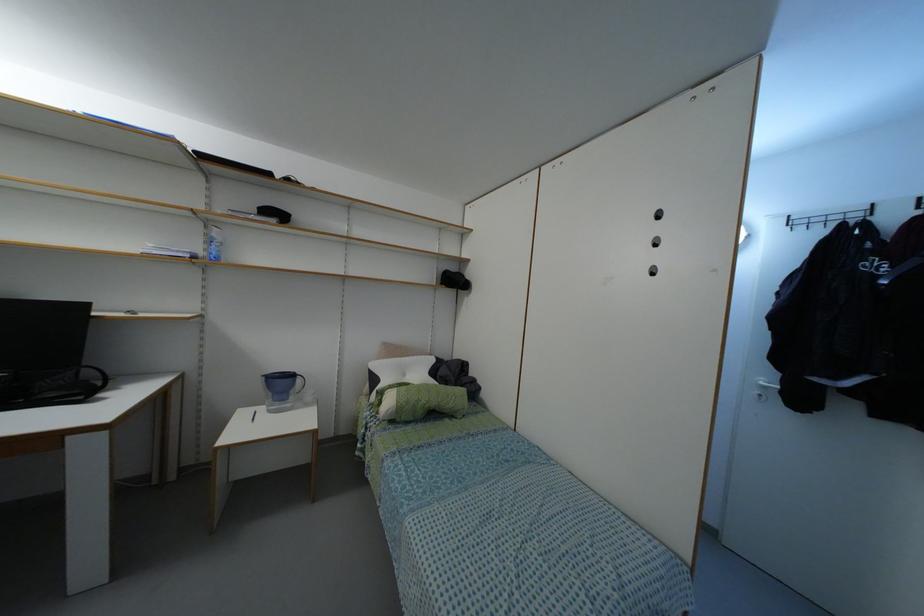
At what (x,y) coordinates should I click in order to perform the action: click on blue spray bottle. Please return your answer as a coordinate pair (x, y). Looking at the image, I should click on (214, 244).